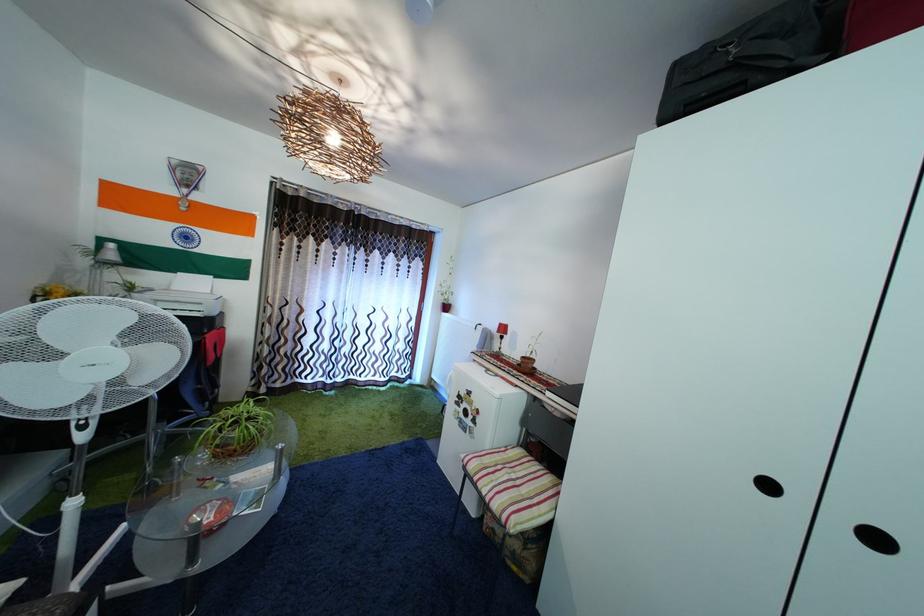
Locate an element on the screen. chair sitting surface is located at coordinates (514, 485).